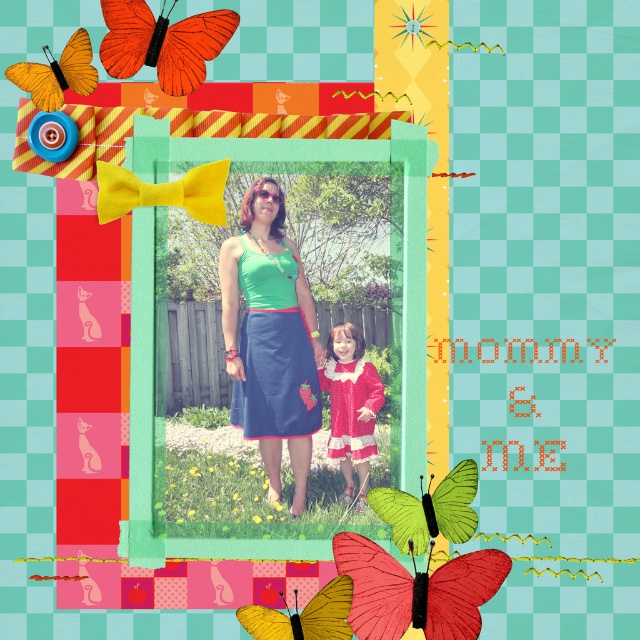
Who is higher up, matte green fabric dress at center or red matte butterfly at center?

Positioned higher is matte green fabric dress at center.

Does matte green fabric dress at center have a greater width compared to red matte butterfly at center?

Incorrect, matte green fabric dress at center's width does not surpass red matte butterfly at center's.

Looking at this image, who is more forward, (272, 410) or (504, 563)?

Point (504, 563) is in front.

The height and width of the screenshot is (640, 640). What are the coordinates of `matte green fabric dress at center` in the screenshot? It's located at (269, 339).

In the scene shown: Between green fabric picture frame at center and green matte butterfly at center, which one appears on the right side from the viewer's perspective?

Positioned to the right is green matte butterfly at center.

Which is in front, point (193, 160) or point (440, 484)?

Positioned in front is point (440, 484).

At what (x,y) coordinates should I click in order to perform the action: click on green fabric picture frame at center. Please return your answer as a coordinate pair (x, y). Image resolution: width=640 pixels, height=640 pixels. Looking at the image, I should click on (400, 234).

The height and width of the screenshot is (640, 640). Describe the element at coordinates (400, 234) in the screenshot. I see `green fabric picture frame at center` at that location.

Looking at this image, does green fabric picture frame at center have a lesser width compared to matte red dress at center?

No.

The height and width of the screenshot is (640, 640). What do you see at coordinates (400, 234) in the screenshot?
I see `green fabric picture frame at center` at bounding box center [400, 234].

Locate an element on the screen. The width and height of the screenshot is (640, 640). green fabric picture frame at center is located at coordinates (400, 234).